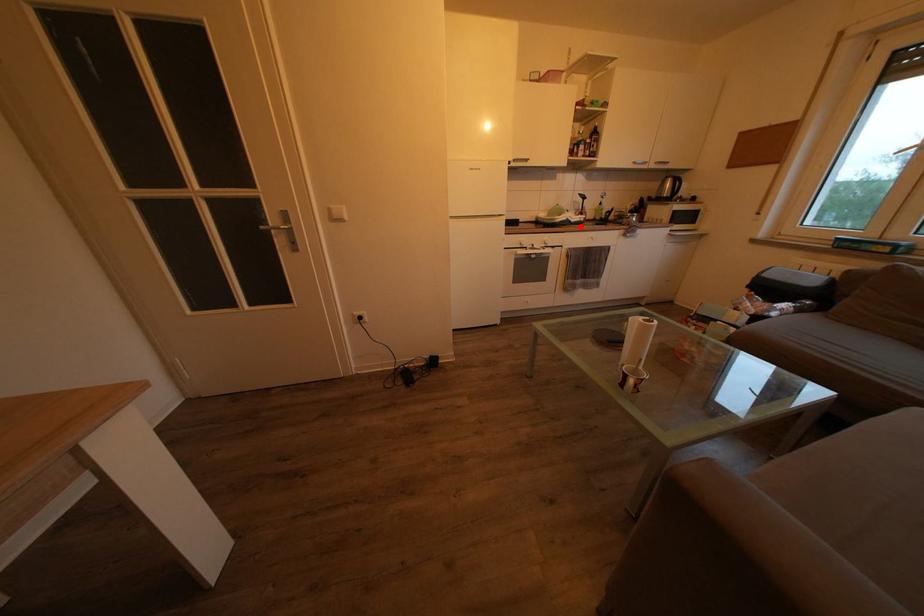
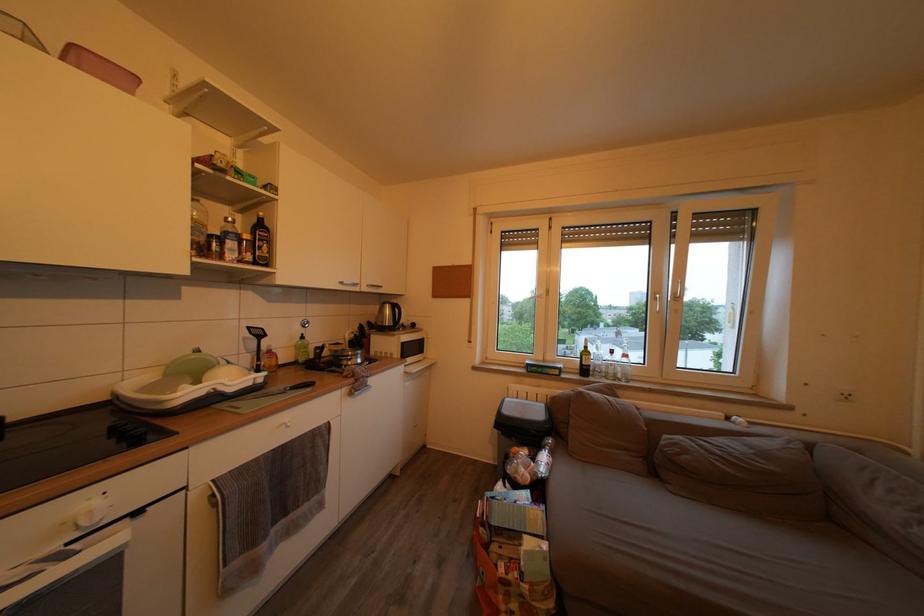
Where in the second image is the point corresponding to the highlighted location from the first image?

(238, 397)